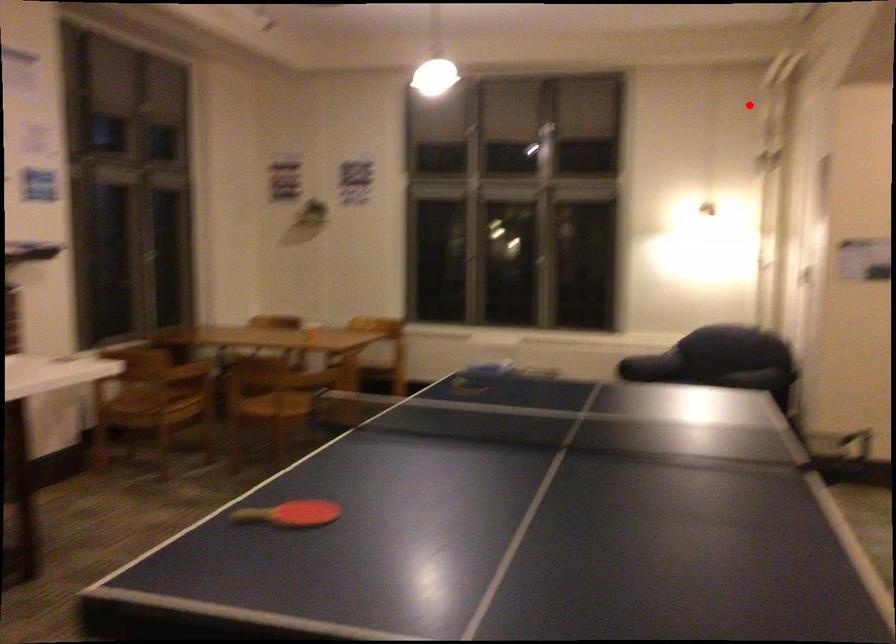
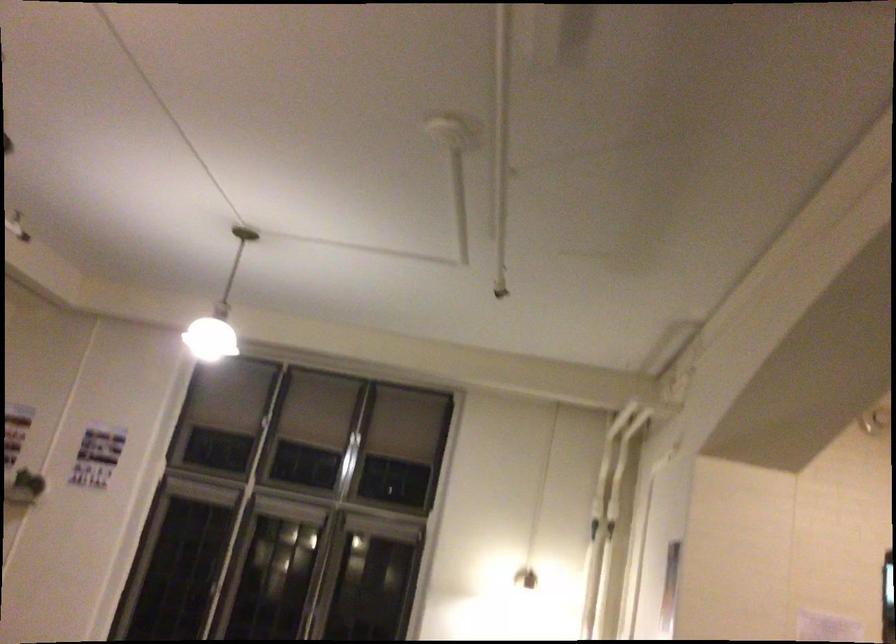
In the second image, find the point that corresponds to the highlighted location in the first image.

(613, 527)